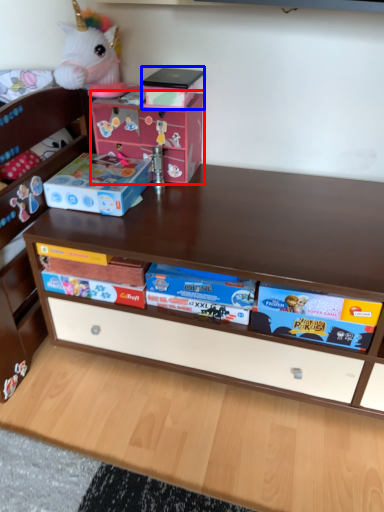
Question: Among these objects, which one is farthest to the camera, cardboard box (highlighted by a red box) or box (highlighted by a blue box)?

Choices:
 (A) cardboard box
 (B) box

Answer: (A)